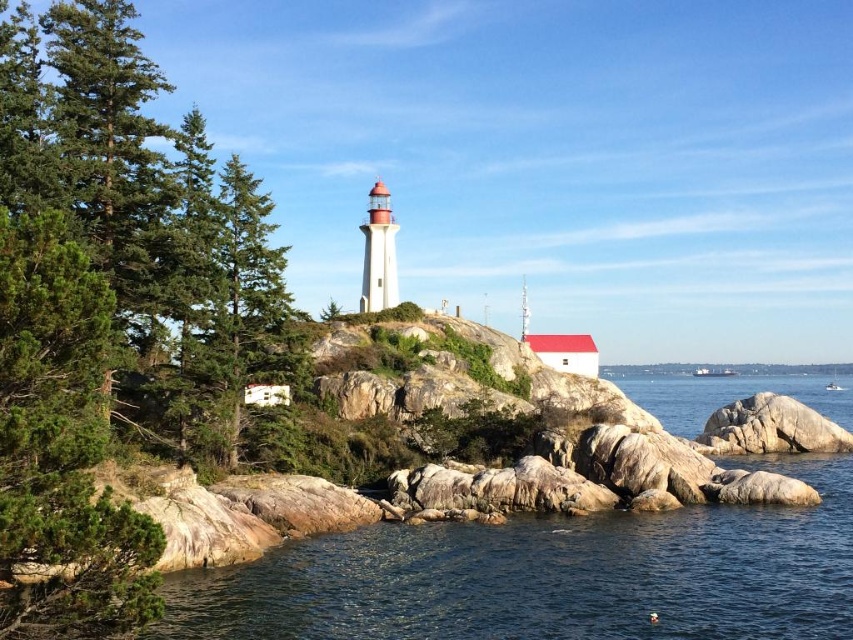
Is point (146, 76) closer to camera compared to point (653, 593)?

No, it is behind (653, 593).

Which is more to the left, green matte tree at upper left or clear water at lower left?

green matte tree at upper left is more to the left.

The height and width of the screenshot is (640, 853). Describe the element at coordinates (106, 307) in the screenshot. I see `green matte tree at upper left` at that location.

The height and width of the screenshot is (640, 853). What are the coordinates of `green matte tree at upper left` in the screenshot? It's located at (106, 307).

Measure the distance between point (x=96, y=108) and camera.

Point (x=96, y=108) and camera are 165.26 feet apart.

Find the location of a particular element. Image resolution: width=853 pixels, height=640 pixels. green matte tree at upper left is located at coordinates (106, 307).

Does clear water at lower left have a greater width compared to gray rock at lower right?

Yes.

Is clear water at lower left positioned at the back of gray rock at lower right?

No, it is not.

Find the location of `clear water at lower left`. clear water at lower left is located at coordinates (549, 576).